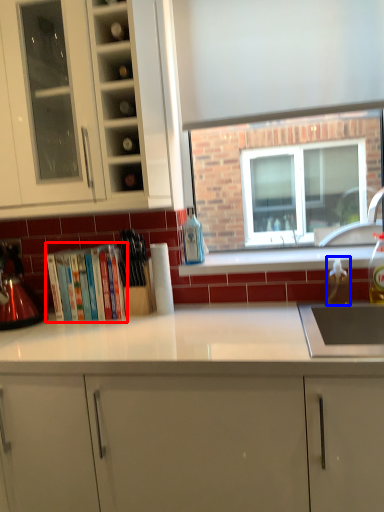
Question: Which object appears closest to the camera in this image, book (highlighted by a red box) or bottle (highlighted by a blue box)?

Choices:
 (A) book
 (B) bottle

Answer: (B)